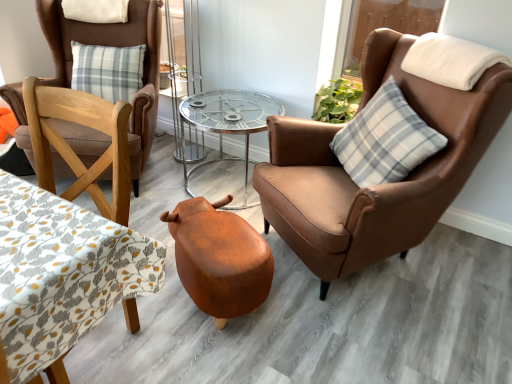
Question: Is leather-like stool at center positioned in front of patterned fabric table at left?

Choices:
 (A) yes
 (B) no

Answer: (B)

Question: Is leather-like stool at center next to patterned fabric table at left?

Choices:
 (A) no
 (B) yes

Answer: (A)

Question: Does leather-like stool at center have a lesser width compared to patterned fabric table at left?

Choices:
 (A) no
 (B) yes

Answer: (A)

Question: From a real-world perspective, does leather-like stool at center stand above patterned fabric table at left?

Choices:
 (A) no
 (B) yes

Answer: (A)

Question: Can you confirm if leather-like stool at center is wider than patterned fabric table at left?

Choices:
 (A) no
 (B) yes

Answer: (B)

Question: Considering the relative positions of leather-like stool at center and patterned fabric table at left in the image provided, is leather-like stool at center to the left of patterned fabric table at left from the viewer's perspective?

Choices:
 (A) no
 (B) yes

Answer: (A)

Question: From a real-world perspective, does white soft pillow at upper left, the 1th pillow viewed from the left, sit lower than patterned fabric table at left?

Choices:
 (A) no
 (B) yes

Answer: (A)

Question: Would you say white soft pillow at upper left, the 1th pillow viewed from the left, contains patterned fabric table at left?

Choices:
 (A) no
 (B) yes

Answer: (A)

Question: Is white soft pillow at upper left, the 1th pillow viewed from the top, in front of patterned fabric table at left?

Choices:
 (A) yes
 (B) no

Answer: (B)

Question: Does white soft pillow at upper left, the 1th pillow viewed from the top, have a lesser width compared to patterned fabric table at left?

Choices:
 (A) yes
 (B) no

Answer: (A)

Question: From the image's perspective, is white soft pillow at upper left, acting as the 3th pillow starting from the bottom, below patterned fabric table at left?

Choices:
 (A) no
 (B) yes

Answer: (A)

Question: Is white soft pillow at upper left, the 1th pillow viewed from the top, further to camera compared to patterned fabric table at left?

Choices:
 (A) yes
 (B) no

Answer: (A)

Question: Considering the relative sizes of leather-like stool at center and brown leather chair at right, positioned as the 1th chair in right-to-left order, in the image provided, is leather-like stool at center wider than brown leather chair at right, positioned as the 1th chair in right-to-left order,?

Choices:
 (A) no
 (B) yes

Answer: (A)